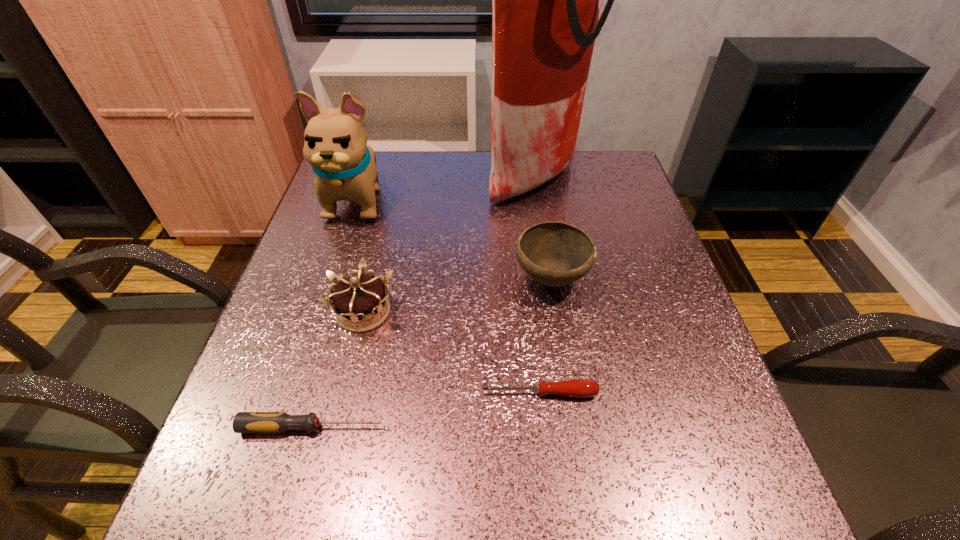
Where is `blank region between the farther screwdriver and the crown`? blank region between the farther screwdriver and the crown is located at coordinates (451, 352).

In order to click on free space between the grocery bag and the right screwdriver in this screenshot , I will do `click(537, 286)`.

You are a GUI agent. You are given a task and a screenshot of the screen. Output one action in this format:
    pyautogui.click(x=<x>, y=<y>)
    Task: Click on the blank region between the nearest object and the fifth shortest object
    The width and height of the screenshot is (960, 540).
    Given the screenshot: What is the action you would take?
    pyautogui.click(x=335, y=313)

Image resolution: width=960 pixels, height=540 pixels. Identify the location of free space between the tallest object and the puppy. (445, 188).

The image size is (960, 540). Find the location of `free point between the fifth farthest object and the bowl`. free point between the fifth farthest object and the bowl is located at coordinates pos(545,336).

Find the location of a particular element. Image resolution: width=960 pixels, height=540 pixels. free point between the grocery bag and the nearest object is located at coordinates (423, 303).

The height and width of the screenshot is (540, 960). I want to click on object that is the fifth closest to the puppy, so click(x=579, y=388).

Locate which object is the third closest to the right screwdriver. Please provide its 2D coordinates. Your answer should be formatted as a tuple, i.e. [(x, y)], where the tuple contains the x and y coordinates of a point satisfying the conditions above.

[(362, 299)]

You are a GUI agent. You are given a task and a screenshot of the screen. Output one action in this format:
    pyautogui.click(x=<x>, y=<y>)
    Task: Click on the free location that satisfies the following two spatial constraints: 1. on the face of the puppy; 2. on the left side of the right screwdriver
    The width and height of the screenshot is (960, 540).
    Given the screenshot: What is the action you would take?
    pyautogui.click(x=295, y=393)

You are a GUI agent. You are given a task and a screenshot of the screen. Output one action in this format:
    pyautogui.click(x=<x>, y=<y>)
    Task: Click on the blank space that satisfies the following two spatial constraints: 1. on the back side of the crown; 2. on the left side of the bowl
    Image resolution: width=960 pixels, height=540 pixels.
    Given the screenshot: What is the action you would take?
    pyautogui.click(x=372, y=278)